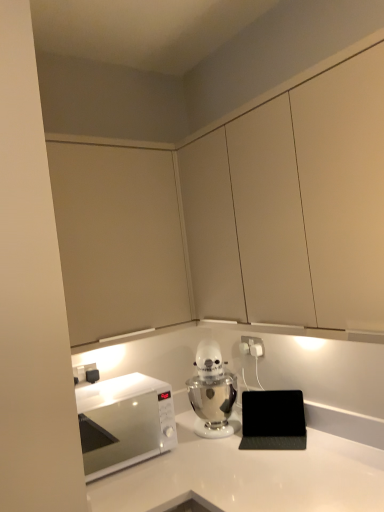
Find the location of a particular element. The image size is (384, 512). blank space situated above white glossy microwave at left (from a real-world perspective) is located at coordinates (119, 390).